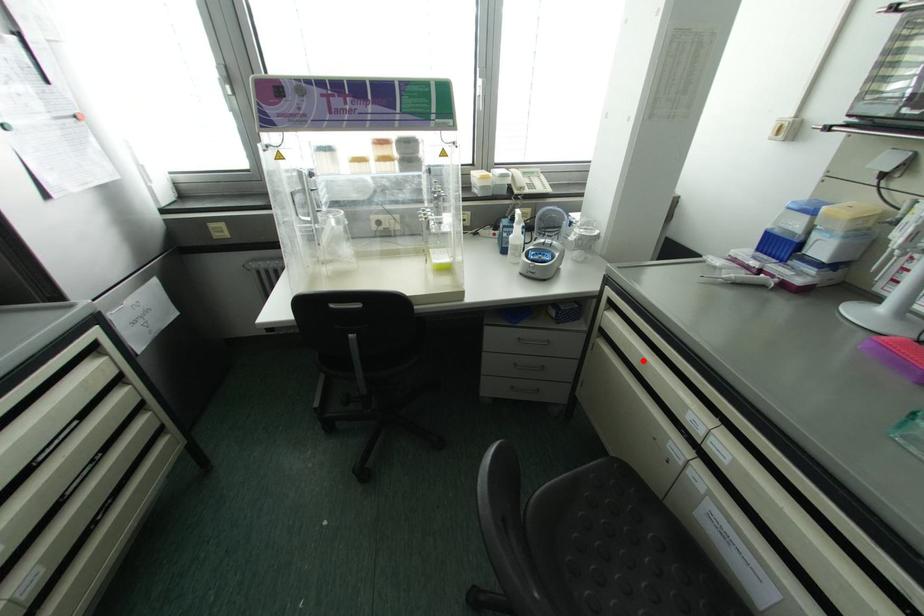
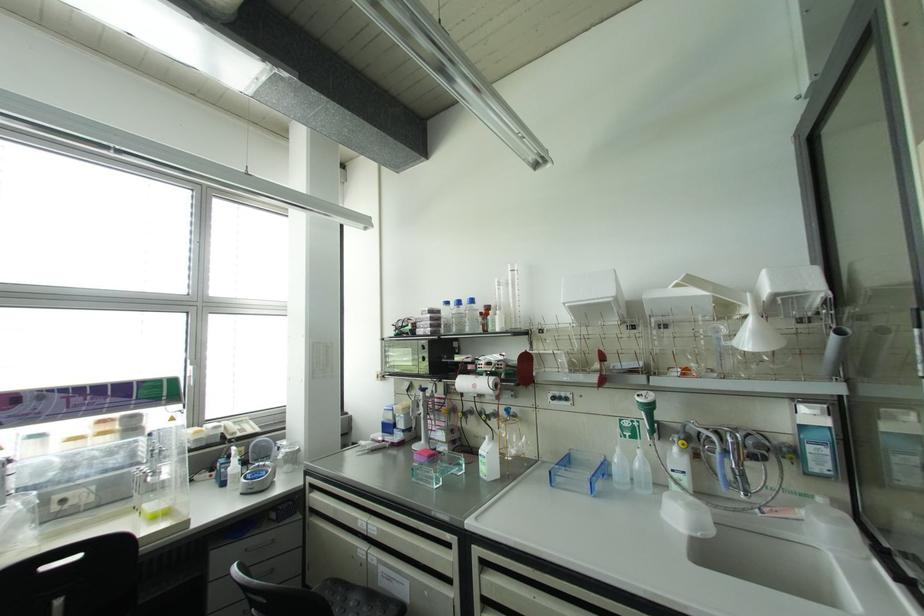
Locate, in the second image, the point that corresponds to the highlighted location in the first image.

(334, 509)